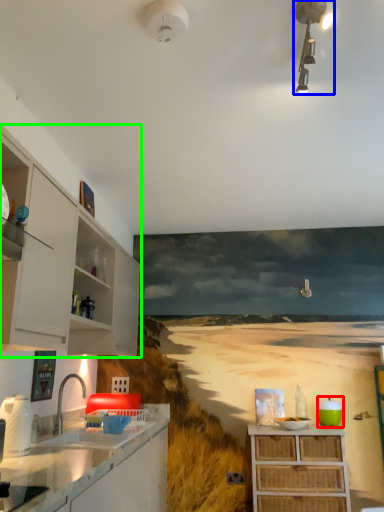
Question: Estimate the real-world distances between objects in this image. Which object is closer to appliance (highlighted by a red box), light fixture (highlighted by a blue box) or cabinetry (highlighted by a green box)?

Choices:
 (A) light fixture
 (B) cabinetry

Answer: (B)